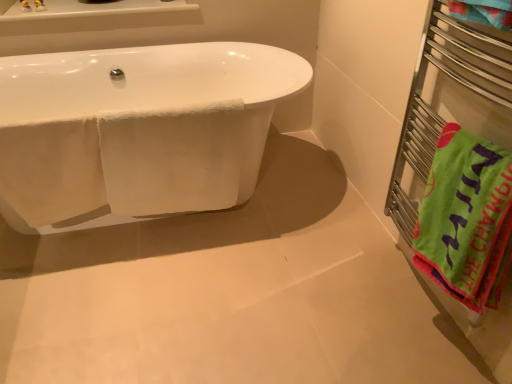
Looking at this image, measure the distance between point (90, 163) and camera.

A distance of 5.17 feet exists between point (90, 163) and camera.

Image resolution: width=512 pixels, height=384 pixels. Describe the element at coordinates (449, 104) in the screenshot. I see `metal towel rack at right` at that location.

The image size is (512, 384). Identify the location of white fluffy towel at center. (172, 159).

Is metal towel rack at right to the left of white glossy bathtub at left from the viewer's perspective?

→ No, metal towel rack at right is not to the left of white glossy bathtub at left.

Is the position of metal towel rack at right less distant than that of white glossy bathtub at left?

Yes, it is in front of white glossy bathtub at left.

Which object is wider, metal towel rack at right or white glossy bathtub at left?

Wider between the two is white glossy bathtub at left.

Choose the correct answer: Is metal towel rack at right inside white glossy bathtub at left or outside it?

metal towel rack at right is outside white glossy bathtub at left.

Is white ceramic window sill at upper left not close to metal towel rack at right?

Yes, white ceramic window sill at upper left and metal towel rack at right are located far from each other.

Does white ceramic window sill at upper left come in front of metal towel rack at right?

No, white ceramic window sill at upper left is further to the viewer.

Looking at this image, does white ceramic window sill at upper left have a lesser height compared to metal towel rack at right?

Yes, white ceramic window sill at upper left is shorter than metal towel rack at right.

How different are the orientations of white ceramic window sill at upper left and metal towel rack at right in degrees?

89.2 degrees separate the facing orientations of white ceramic window sill at upper left and metal towel rack at right.

Locate an element on the screen. window sill behind the white glossy bathtub at left is located at coordinates (93, 9).

Consider the image. Is white ceramic window sill at upper left far away from white glossy bathtub at left?

white ceramic window sill at upper left is near white glossy bathtub at left, not far away.

Does white ceramic window sill at upper left turn towards white glossy bathtub at left?

No, white ceramic window sill at upper left is not turned towards white glossy bathtub at left.

Is white glossy bathtub at left inside white ceramic window sill at upper left?

No, white glossy bathtub at left is not inside white ceramic window sill at upper left.

Which of these two, metal towel rack at right or white fluffy towel at center, is smaller?

Smaller between the two is white fluffy towel at center.

Is point (449, 70) positioned in front of point (116, 187)?

That is True.

Does metal towel rack at right appear on the right side of white fluffy towel at center?

Correct, you'll find metal towel rack at right to the right of white fluffy towel at center.

Which object is further away from the camera, metal towel rack at right or white fluffy towel at center?

white fluffy towel at center is further from the camera.

How far apart are white glossy bathtub at left and green cotton beach towel at right?

white glossy bathtub at left and green cotton beach towel at right are 3.35 feet apart from each other.

Is white glossy bathtub at left wider or thinner than green cotton beach towel at right?

white glossy bathtub at left is wider than green cotton beach towel at right.

How many degrees apart are the facing directions of white glossy bathtub at left and green cotton beach towel at right?

90 degrees.

Is green cotton beach towel at right at the back of white glossy bathtub at left?

No, white glossy bathtub at left is not facing the opposite direction of green cotton beach towel at right.

Considering the points (198, 124) and (32, 20), which point is in front, point (198, 124) or point (32, 20)?

Positioned in front is point (198, 124).

What's the angular difference between white fluffy towel at center and white ceramic window sill at upper left's facing directions?

The facing directions of white fluffy towel at center and white ceramic window sill at upper left are 2.39 degrees apart.

From the picture: Could you tell me if white fluffy towel at center is facing white ceramic window sill at upper left?

No, white fluffy towel at center is not facing towards white ceramic window sill at upper left.

Is green cotton beach towel at right placed right next to white glossy bathtub at left?

No.

Considering the sizes of green cotton beach towel at right and white glossy bathtub at left in the image, is green cotton beach towel at right wider or thinner than white glossy bathtub at left?

green cotton beach towel at right is thinner than white glossy bathtub at left.

What's the angular difference between green cotton beach towel at right and white glossy bathtub at left's facing directions?

The facing directions of green cotton beach towel at right and white glossy bathtub at left are 90 degrees apart.

Is green cotton beach towel at right taller than white glossy bathtub at left?

In fact, green cotton beach towel at right may be shorter than white glossy bathtub at left.

At what (x,y) coordinates should I click in order to perform the action: click on balustrade above the white glossy bathtub at left (from a real-world perspective). Please return your answer as a coordinate pair (x, y). This screenshot has width=512, height=384. Looking at the image, I should click on (449, 104).

At what (x,y) coordinates should I click in order to perform the action: click on balustrade that is below the white ceramic window sill at upper left (from the image's perspective). Please return your answer as a coordinate pair (x, y). The image size is (512, 384). Looking at the image, I should click on (449, 104).

Estimate the real-world distances between objects in this image. Which object is closer to green cotton beach towel at right, white fluffy towel at center or white glossy bathtub at left?

The object closer to green cotton beach towel at right is white fluffy towel at center.

When comparing their distances from green cotton beach towel at right, does white glossy bathtub at left or white fluffy towel at center seem closer?

Among the two, white fluffy towel at center is located nearer to green cotton beach towel at right.

Which object lies further to the anchor point white fluffy towel at center, metal towel rack at right or green cotton beach towel at right?

The object further to white fluffy towel at center is green cotton beach towel at right.

Looking at this image, based on their spatial positions, is white ceramic window sill at upper left or white fluffy towel at center closer to metal towel rack at right?

white fluffy towel at center lies closer to metal towel rack at right than the other object.

Looking at the image, which one is located closer to white fluffy towel at center, white ceramic window sill at upper left or green cotton beach towel at right?

Among the two, green cotton beach towel at right is located nearer to white fluffy towel at center.

Estimate the real-world distances between objects in this image. Which object is further from white glossy bathtub at left, green cotton beach towel at right or white ceramic window sill at upper left?

green cotton beach towel at right is further to white glossy bathtub at left.

From the image, which object appears to be farther from white fluffy towel at center, metal towel rack at right or white ceramic window sill at upper left?

The object further to white fluffy towel at center is white ceramic window sill at upper left.

Looking at the image, which one is located closer to white ceramic window sill at upper left, white glossy bathtub at left or green cotton beach towel at right?

white glossy bathtub at left is positioned closer to the anchor white ceramic window sill at upper left.

Locate an element on the screen. This screenshot has width=512, height=384. bathtub between white ceramic window sill at upper left and white fluffy towel at center in the vertical direction is located at coordinates (138, 128).

The height and width of the screenshot is (384, 512). I want to click on bath towel located between white ceramic window sill at upper left and metal towel rack at right in the left-right direction, so click(x=172, y=159).

Locate an element on the screen. This screenshot has width=512, height=384. bath towel between white glossy bathtub at left and metal towel rack at right from left to right is located at coordinates (172, 159).

Locate an element on the screen. The width and height of the screenshot is (512, 384). beach towel between white fluffy towel at center and metal towel rack at right from left to right is located at coordinates (466, 219).